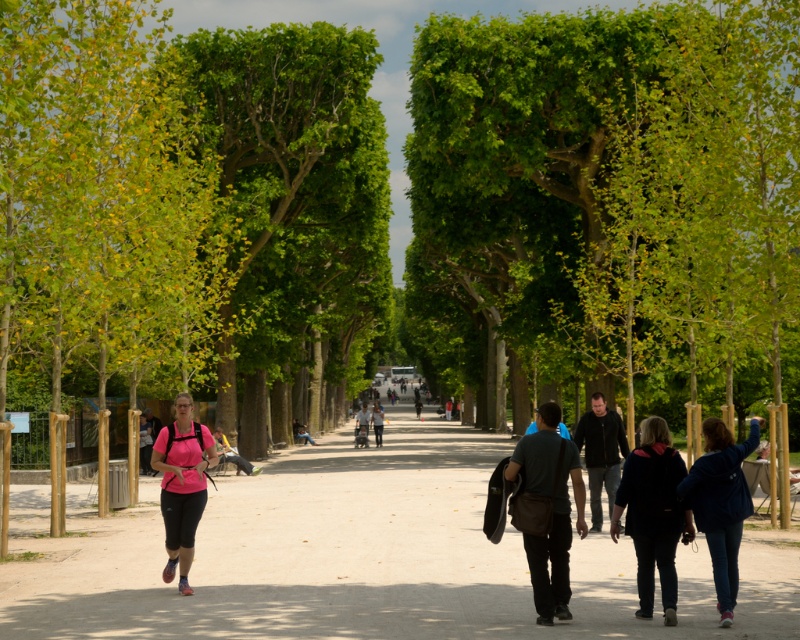
Based on the photo, you are a hiker who wants to carry both the pink fabric backpack at center and the matte black backpack at center on a trail. Since you can only wear one backpack at a time, which one should you choose to wear first if you want to carry the taller one on your back?

The matte black backpack at center is taller than the pink fabric backpack at center, so you should wear the matte black backpack at center first to carry the taller one on your back.

You are a photographer standing on the pathway and want to take a picture of the pink fabric backpack at center and the matte black backpack at center. Which backpack should you focus on first if you want to capture both in the same frame without moving the camera?

The pink fabric backpack at center should be focused on first because it is located above the matte black backpack at center, so adjusting the camera to include both would require ensuring the upper backpack is in focus before the lower one.